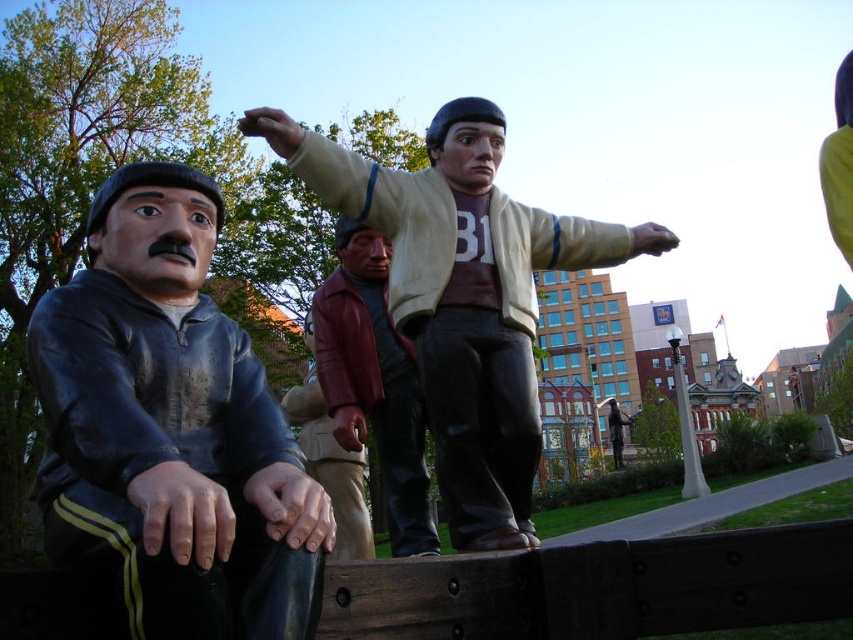
Is shiny black jacket at left to the right of matte beige jacket at center from the viewer's perspective?

No, shiny black jacket at left is not to the right of matte beige jacket at center.

Between shiny black jacket at left and matte beige jacket at center, which one is positioned lower?

Positioned lower is shiny black jacket at left.

The image size is (853, 640). Describe the element at coordinates (170, 429) in the screenshot. I see `shiny black jacket at left` at that location.

Identify the location of shiny black jacket at left. (170, 429).

Can you confirm if shiny black jacket at left is shorter than shiny maroon jacket at center?

Yes.

Which is below, shiny black jacket at left or shiny maroon jacket at center?

shiny maroon jacket at center is below.

Is point (91, 429) closer to viewer compared to point (402, 420)?

That is True.

Find the location of a particular element. This screenshot has width=853, height=640. shiny black jacket at left is located at coordinates (170, 429).

Looking at this image, between matte beige jacket at center and shiny maroon jacket at center, which one appears on the right side from the viewer's perspective?

matte beige jacket at center

Which is behind, point (450, 349) or point (393, 380)?

The point (393, 380) is behind.

Is point (485, 244) positioned in front of point (369, 268)?

That is True.

Locate an element on the screen. matte beige jacket at center is located at coordinates (463, 296).